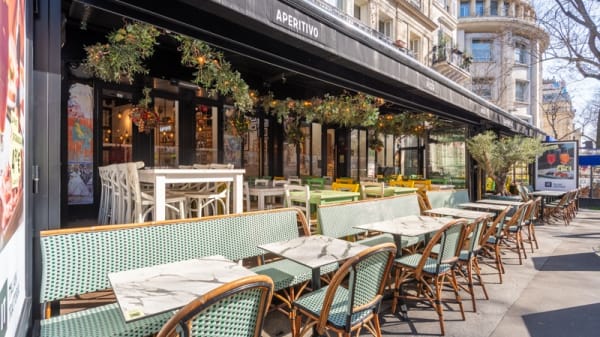
This screenshot has height=337, width=600. I want to click on tables, so click(151, 289), click(324, 243), click(411, 219), click(466, 214), click(491, 208), click(509, 204), click(166, 169), click(265, 190).